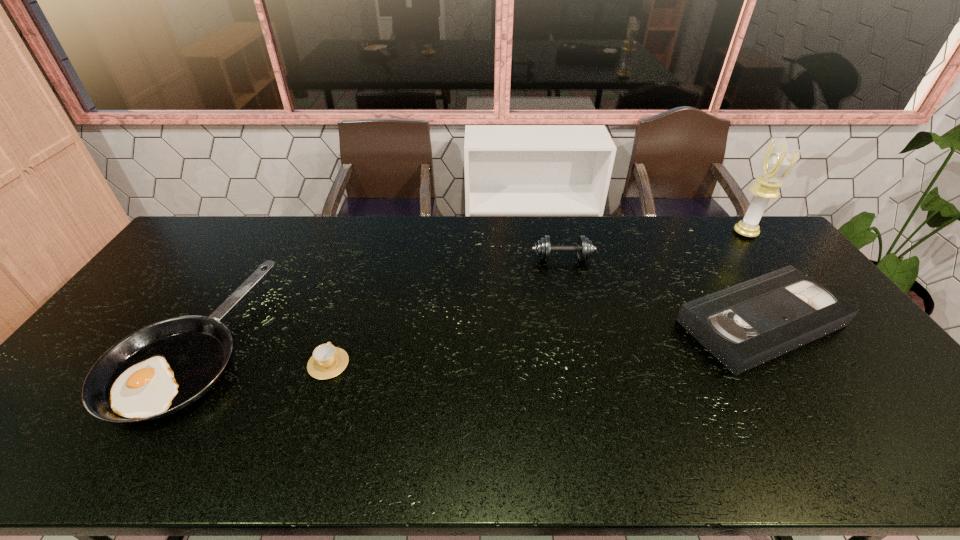
The width and height of the screenshot is (960, 540). What are the coordinates of `vacant space that is in between the videotape and the leftmost object` in the screenshot? It's located at (476, 333).

Locate an element on the screen. empty space between the videotape and the shortest object is located at coordinates (544, 343).

Where is `vacant space that is in between the shortest object and the fourth tallest object`? vacant space that is in between the shortest object and the fourth tallest object is located at coordinates (544, 343).

The width and height of the screenshot is (960, 540). I want to click on vacant space that is in between the award and the videotape, so click(x=754, y=278).

Identify the location of vacant area that lies between the leftmost object and the second shortest object. The height and width of the screenshot is (540, 960). (476, 333).

Where is `free point between the shortest object and the videotape`? The height and width of the screenshot is (540, 960). free point between the shortest object and the videotape is located at coordinates (544, 343).

Where is `unoccupied position between the second shortest object and the frying pan`? unoccupied position between the second shortest object and the frying pan is located at coordinates (476, 333).

Locate an element on the screen. empty space that is in between the videotape and the second farthest object is located at coordinates (x=661, y=291).

Find the location of a particular element. This screenshot has height=540, width=960. object that is the fourth closest to the fourth tallest object is located at coordinates (162, 368).

Choose which object is the nearest neighbor to the shortest object. Please provide its 2D coordinates. Your answer should be formatted as a tuple, i.e. [(x, y)], where the tuple contains the x and y coordinates of a point satisfying the conditions above.

[(162, 368)]